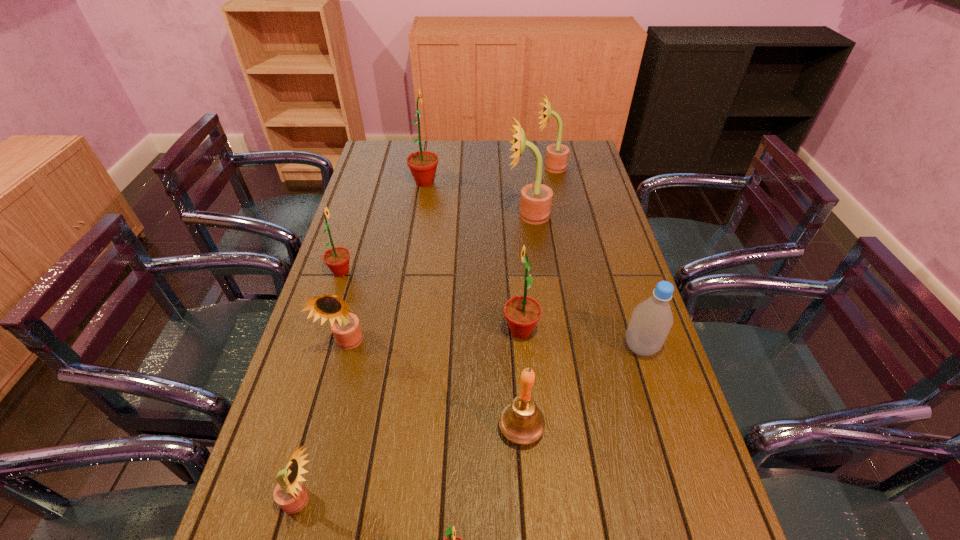
What are the coordinates of `the eighth farthest object` in the screenshot? It's located at (521, 421).

Find the location of a particular element. bottle is located at coordinates (650, 323).

The image size is (960, 540). In order to click on the rightmost object in this screenshot , I will do `click(650, 323)`.

Where is `the smallest yellow sunflower`? This screenshot has width=960, height=540. the smallest yellow sunflower is located at coordinates (290, 494).

Where is `the nearest yellow sunflower`? The image size is (960, 540). the nearest yellow sunflower is located at coordinates (290, 494).

Identify the location of free space located 0.130m on the face of the eighth nearest object. (468, 215).

Identify the location of free space located on the face of the eighth nearest object. The image size is (960, 540). (457, 215).

The height and width of the screenshot is (540, 960). I want to click on vacant point located 0.280m on the face of the eighth nearest object, so click(x=426, y=215).

Where is `free space located on the face of the biggest green sunflower`? free space located on the face of the biggest green sunflower is located at coordinates (464, 182).

Find the location of a particular element. vacant space located on the face of the farthest yellow sunflower is located at coordinates (443, 167).